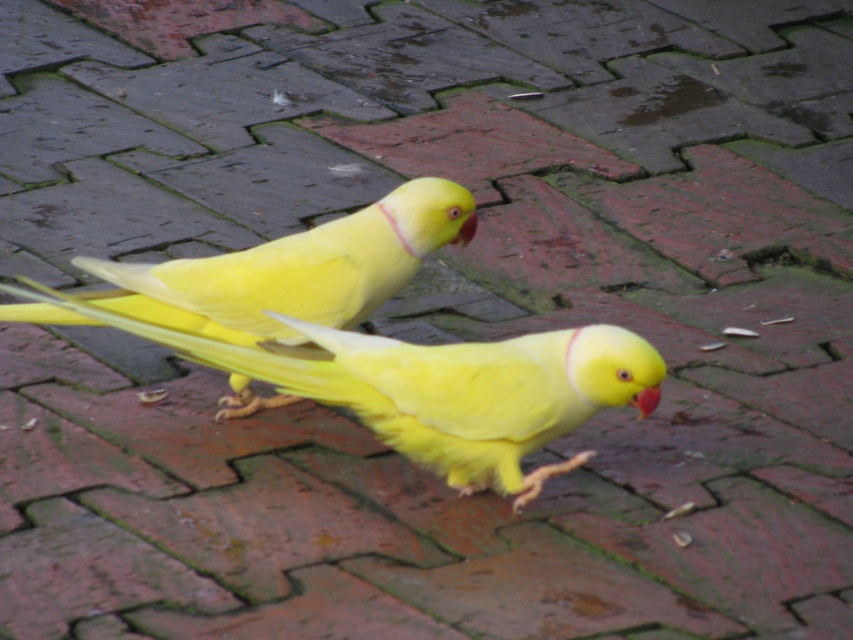
Question: Which object is closer to the camera taking this photo?

Choices:
 (A) red matte beak at center
 (B) yellow matte beak at center
 (C) yellow matte canary at center

Answer: (B)

Question: Is yellow matte parrot at center positioned behind red matte beak at center?

Choices:
 (A) no
 (B) yes

Answer: (A)

Question: Is yellow matte parrot at center positioned in front of yellow matte canary at center?

Choices:
 (A) yes
 (B) no

Answer: (A)

Question: Among these objects, which one is nearest to the camera?

Choices:
 (A) yellow matte canary at center
 (B) yellow matte parrot at center
 (C) yellow matte beak at center

Answer: (B)

Question: Which of the following is the closest to the observer?

Choices:
 (A) yellow matte beak at center
 (B) yellow matte parrot at center
 (C) red matte beak at center

Answer: (B)

Question: Does yellow matte canary at center come in front of red matte beak at center?

Choices:
 (A) no
 (B) yes

Answer: (B)